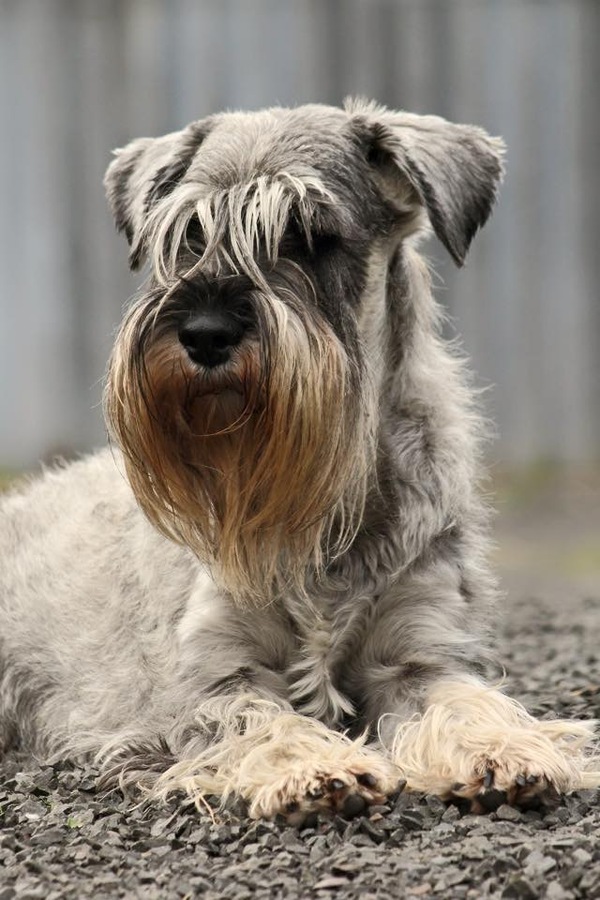
At what (x,y) coordinates should I click in order to perform the action: click on white fur. Please return your answer as a coordinate pair (x, y). Looking at the image, I should click on (73, 572), (450, 364), (206, 217), (164, 228), (268, 209), (243, 227), (146, 169), (403, 130), (478, 702), (226, 748).